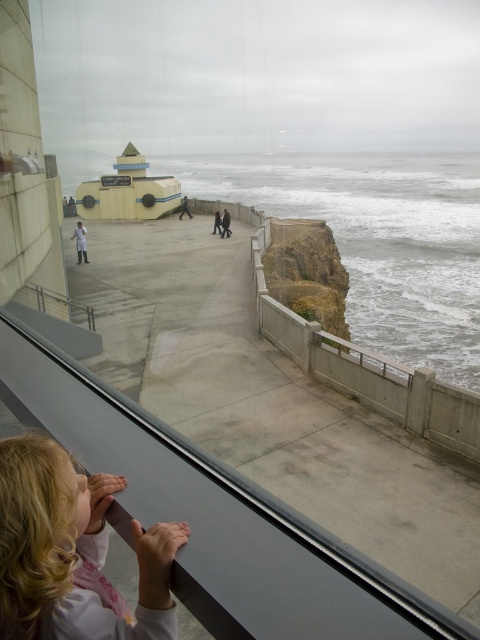
Is blonde hair at lower left closer to the viewer compared to white matte shirt at center?

Yes.

Is point (48, 628) farther from camera compared to point (73, 236)?

That is False.

Is point (3, 637) farther from camera compared to point (75, 241)?

No, it is not.

The image size is (480, 640). In order to click on blonde hair at lower left in this screenshot , I will do `click(72, 552)`.

Between blonde hair at lower left and dark gray concrete figure at center, which one appears on the left side from the viewer's perspective?

Positioned to the left is dark gray concrete figure at center.

Based on the photo, how far apart are blonde hair at lower left and dark gray concrete figure at center?

They are 33.40 meters apart.

Which is behind, point (81, 480) or point (183, 195)?

Point (183, 195)

Locate an element on the screen. blonde hair at lower left is located at coordinates (72, 552).

Does white matte shirt at center have a larger size compared to dark blue jeans at center?

Yes, white matte shirt at center is bigger than dark blue jeans at center.

Between point (83, 246) and point (220, 218), which one is positioned in front?

Point (83, 246) is more forward.

Which is in front, point (72, 236) or point (219, 220)?

Point (72, 236)

Image resolution: width=480 pixels, height=640 pixels. I want to click on white matte shirt at center, so click(81, 241).